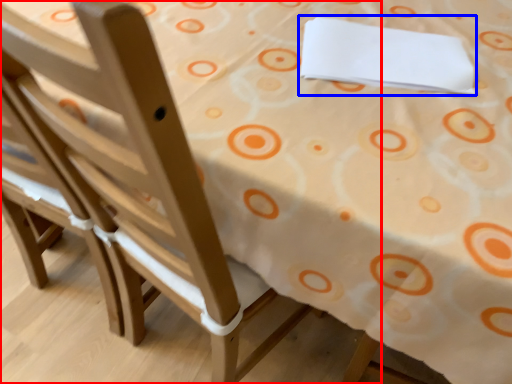
Question: Which object is closer to the camera taking this photo, chair (highlighted by a red box) or linen (highlighted by a blue box)?

Choices:
 (A) chair
 (B) linen

Answer: (A)